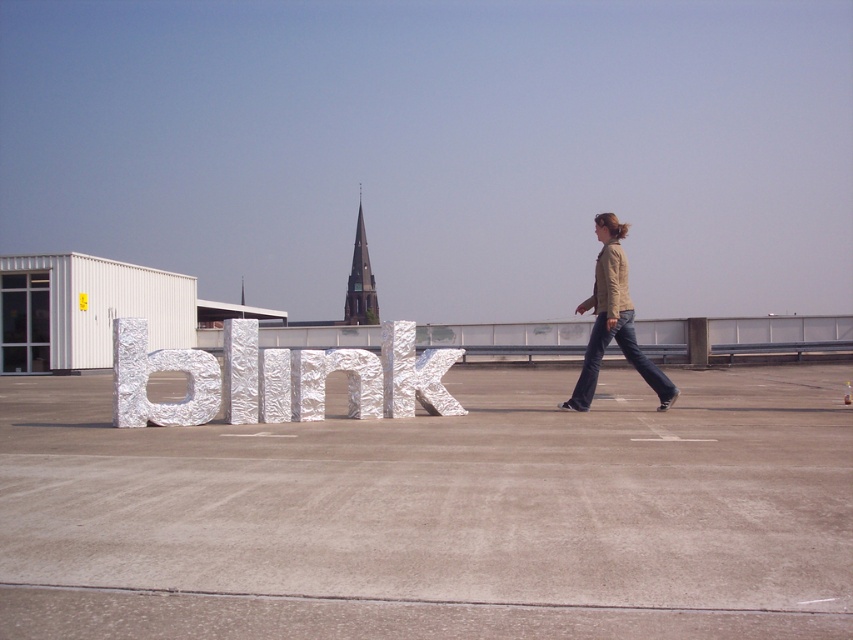
Question: Can you confirm if white concrete tarmac at center is positioned above beige leather jacket at right?

Choices:
 (A) yes
 (B) no

Answer: (B)

Question: Among these objects, which one is farthest from the camera?

Choices:
 (A) shiny metallic letter at center
 (B) beige leather jacket at right
 (C) dark brown stone spire at center

Answer: (C)

Question: Which point appears farthest from the camera in this image?

Choices:
 (A) (367, 273)
 (B) (463, 486)
 (C) (619, 260)

Answer: (A)

Question: Is shiny metallic letter at center to the right of beige leather jacket at right from the viewer's perspective?

Choices:
 (A) no
 (B) yes

Answer: (A)

Question: Estimate the real-world distances between objects in this image. Which object is closer to the shiny metallic letter at center?

Choices:
 (A) beige leather jacket at right
 (B) white concrete tarmac at center
 (C) dark brown stone spire at center

Answer: (B)

Question: Is shiny metallic letter at center below dark brown stone spire at center?

Choices:
 (A) yes
 (B) no

Answer: (A)